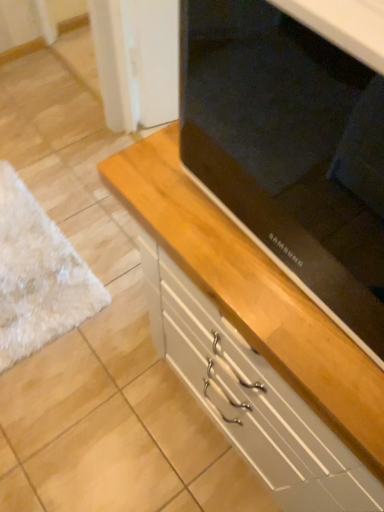
Describe the element at coordinates (252, 340) in the screenshot. I see `wooden cabinet at center` at that location.

Locate an element on the screen. Image resolution: width=384 pixels, height=512 pixels. wooden cabinet at center is located at coordinates (252, 340).

Describe the element at coordinates (289, 151) in the screenshot. Image resolution: width=384 pixels, height=512 pixels. I see `matte black tv at center` at that location.

Identify the location of matte black tv at center. (289, 151).

I want to click on wooden cabinet at center, so click(x=252, y=340).

Does wooden cabinet at center appear on the right side of matte black tv at center?

No.

Which object is closer to the camera, wooden cabinet at center or matte black tv at center?

matte black tv at center is more forward.

Is point (314, 345) positioned in front of point (221, 56)?

Yes, it is in front of point (221, 56).

From the image's perspective, does wooden cabinet at center appear lower than matte black tv at center?

Yes.

From a real-world perspective, is wooden cabinet at center below matte black tv at center?

Correct, in the physical world, wooden cabinet at center is lower than matte black tv at center.

Does wooden cabinet at center have a greater width compared to matte black tv at center?

Correct, the width of wooden cabinet at center exceeds that of matte black tv at center.

Considering the sizes of wooden cabinet at center and matte black tv at center in the image, is wooden cabinet at center taller or shorter than matte black tv at center?

Clearly, wooden cabinet at center is taller compared to matte black tv at center.

From the picture: Considering the relative sizes of wooden cabinet at center and matte black tv at center in the image provided, is wooden cabinet at center bigger than matte black tv at center?

Indeed, wooden cabinet at center has a larger size compared to matte black tv at center.

Is matte black tv at center located within wooden cabinet at center?

Actually, matte black tv at center is outside wooden cabinet at center.

Would you consider wooden cabinet at center to be distant from matte black tv at center?

wooden cabinet at center is actually quite close to matte black tv at center.

Is wooden cabinet at center oriented towards matte black tv at center?

No, wooden cabinet at center does not turn towards matte black tv at center.

How different are the orientations of wooden cabinet at center and matte black tv at center in degrees?

1.52 degrees.

Where is `chest of drawers on the left of matte black tv at center`? chest of drawers on the left of matte black tv at center is located at coordinates (252, 340).

Which is more to the left, matte black tv at center or wooden cabinet at center?

wooden cabinet at center is more to the left.

Is matte black tv at center positioned in front of wooden cabinet at center?

Yes, matte black tv at center is closer to the camera.

Does point (275, 165) come closer to viewer compared to point (358, 468)?

No, it is behind (358, 468).

From the image's perspective, which one is positioned higher, matte black tv at center or wooden cabinet at center?

matte black tv at center is shown above in the image.

From a real-world perspective, between matte black tv at center and wooden cabinet at center, who is vertically higher?

From a 3D spatial view, matte black tv at center is above.

Between matte black tv at center and wooden cabinet at center, which one has smaller width?

matte black tv at center is thinner.

Based on the photo, considering the sizes of objects matte black tv at center and wooden cabinet at center in the image provided, who is taller, matte black tv at center or wooden cabinet at center?

wooden cabinet at center is taller.

Considering the relative sizes of matte black tv at center and wooden cabinet at center in the image provided, is matte black tv at center smaller than wooden cabinet at center?

Correct, matte black tv at center occupies less space than wooden cabinet at center.

Is matte black tv at center not inside wooden cabinet at center?

Yes, matte black tv at center is not within wooden cabinet at center.

Would you say matte black tv at center is a long distance from wooden cabinet at center?

No, matte black tv at center is not far away from wooden cabinet at center.

Does matte black tv at center turn towards wooden cabinet at center?

No, matte black tv at center is not aimed at wooden cabinet at center.

Can you tell me how much matte black tv at center and wooden cabinet at center differ in facing direction?

The facing directions of matte black tv at center and wooden cabinet at center are 1.52 degrees apart.

Where is `appliance in front of the wooden cabinet at center`? This screenshot has width=384, height=512. appliance in front of the wooden cabinet at center is located at coordinates (289, 151).

Image resolution: width=384 pixels, height=512 pixels. Identify the location of the chest of drawers located below the matte black tv at center (from the image's perspective). (252, 340).

Image resolution: width=384 pixels, height=512 pixels. I want to click on appliance positioned vertically above the wooden cabinet at center (from a real-world perspective), so click(x=289, y=151).